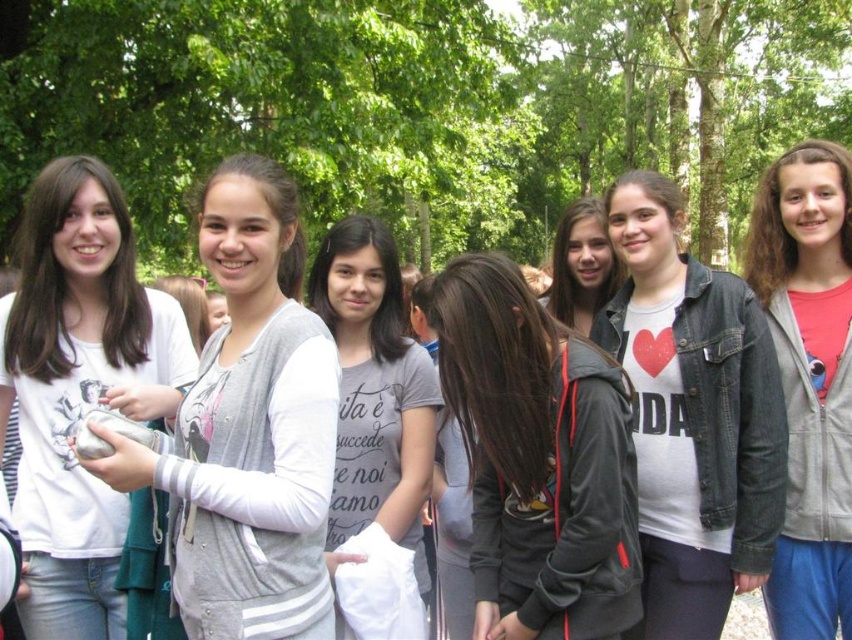
You are standing in the park and see two points in the scene. The first point is at coordinates point (639, 248) and the second is at point (586, 252). Which point is closer to you?

Point (639, 248) is closer to the viewer than point (586, 252).